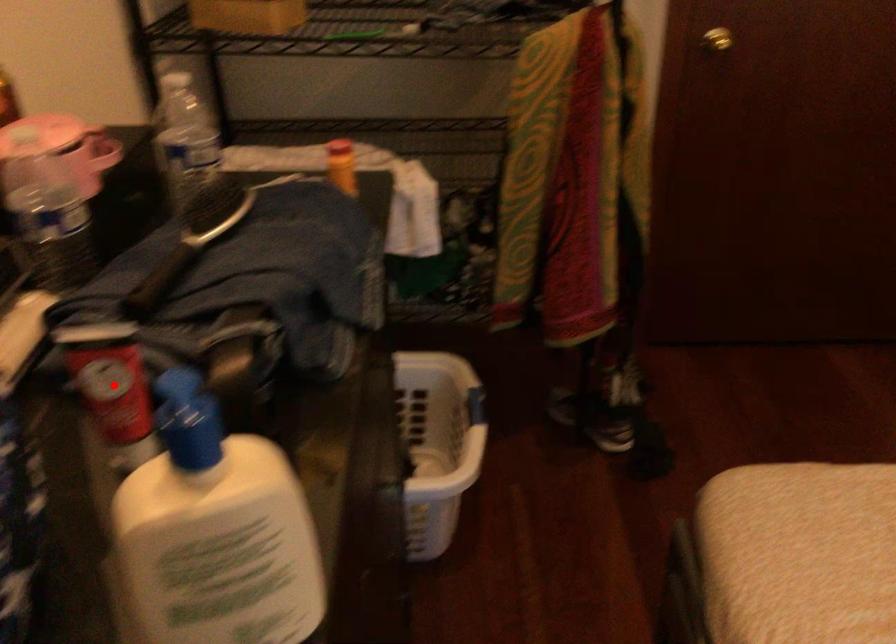
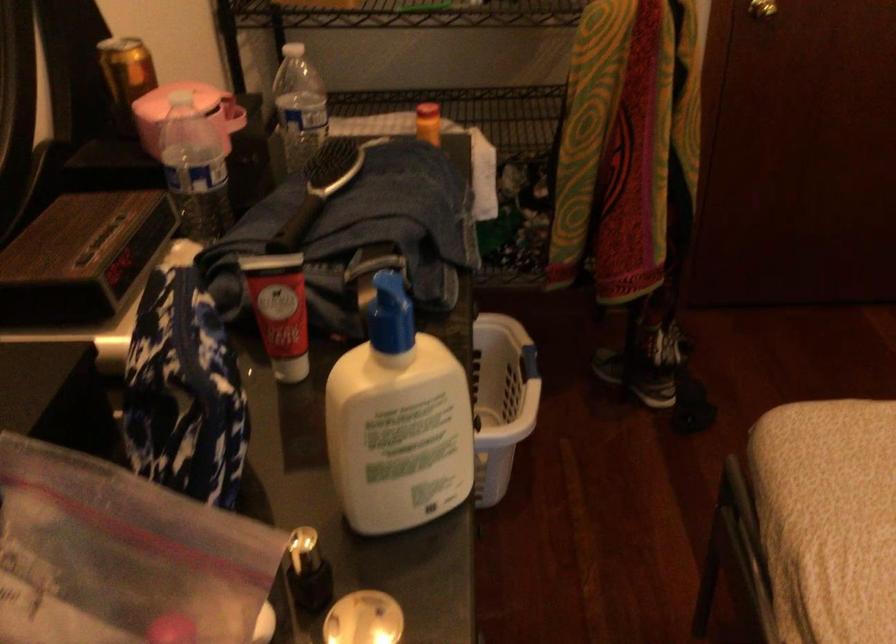
Question: I am providing you with two images of the same scene from different viewpoints. Image1 has a red point marked. In image2, the corresponding 3D location appears at what relative position? Reply with the corresponding letter.

Choices:
 (A) Closer
 (B) Farther

Answer: (B)